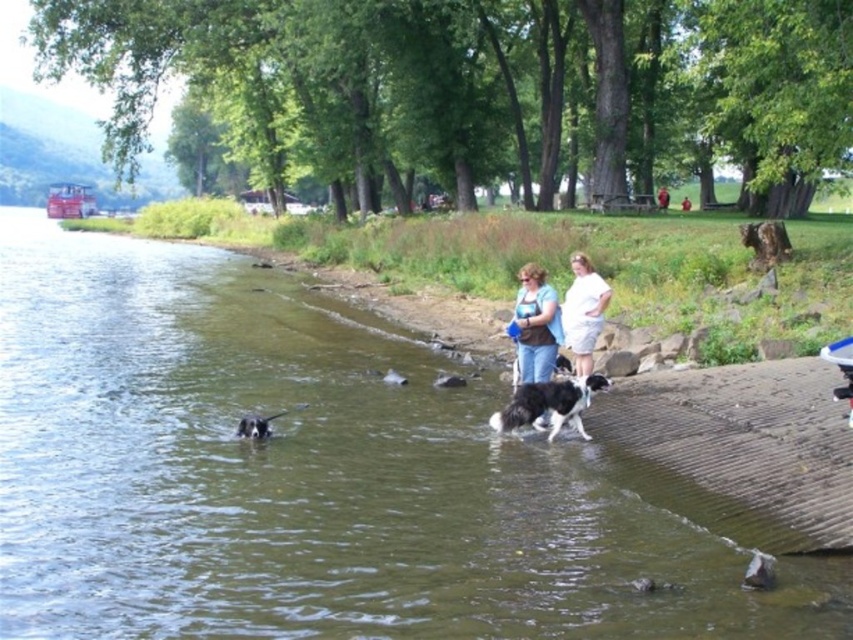
Question: Based on their relative distances, which object is nearer to the white cotton shirt at center?

Choices:
 (A) blue jeans at center
 (B) black and white fur dog at center
 (C) black and white fur dog at lower left
 (D) black and white fur at center

Answer: (D)

Question: Does greenish-brown water at lower left lie behind blue jeans at center?

Choices:
 (A) yes
 (B) no

Answer: (B)

Question: Is white cotton shirt at center further to camera compared to black and white fur dog at lower left?

Choices:
 (A) yes
 (B) no

Answer: (A)

Question: Does blue jeans at center lie in front of black and white fur at center?

Choices:
 (A) no
 (B) yes

Answer: (B)

Question: Which of the following is the farthest from the observer?

Choices:
 (A) pos(804,568)
 (B) pos(264,429)

Answer: (B)

Question: Which object appears closest to the camera in this image?

Choices:
 (A) black and white fur dog at center
 (B) blue jeans at center
 (C) black and white fur dog at lower left
 (D) white cotton shirt at center

Answer: (A)